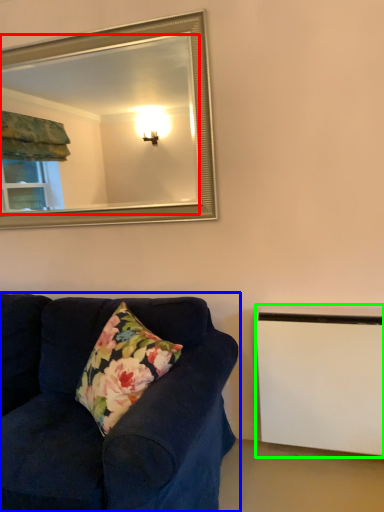
Question: Based on their relative distances, which object is nearer to mirror (highlighted by a red box)? Choose from studio couch (highlighted by a blue box) and radiator (highlighted by a green box).

Choices:
 (A) studio couch
 (B) radiator

Answer: (A)